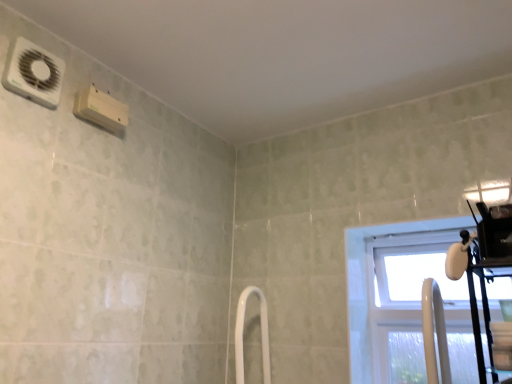
Question: From a real-world perspective, is white glossy shower door at center physically below transparent plastic window at right?

Choices:
 (A) yes
 (B) no

Answer: (A)

Question: Does white glossy shower door at center have a larger size compared to transparent plastic window at right?

Choices:
 (A) yes
 (B) no

Answer: (B)

Question: From the image's perspective, is white glossy shower door at center above transparent plastic window at right?

Choices:
 (A) no
 (B) yes

Answer: (A)

Question: Can you confirm if white glossy shower door at center is positioned to the left of transparent plastic window at right?

Choices:
 (A) no
 (B) yes

Answer: (B)

Question: Is white glossy shower door at center not close to transparent plastic window at right?

Choices:
 (A) yes
 (B) no

Answer: (B)

Question: Is white glossy shower door at center taller or shorter than transparent plastic window at right?

Choices:
 (A) tall
 (B) short

Answer: (B)

Question: In the image, is white glossy shower door at center on the left side or the right side of transparent plastic window at right?

Choices:
 (A) left
 (B) right

Answer: (A)

Question: From a real-world perspective, is white glossy shower door at center above or below transparent plastic window at right?

Choices:
 (A) above
 (B) below

Answer: (B)

Question: From the image's perspective, is white glossy shower door at center positioned above or below transparent plastic window at right?

Choices:
 (A) below
 (B) above

Answer: (A)

Question: Does point (41, 104) appear closer or farther from the camera than point (266, 357)?

Choices:
 (A) farther
 (B) closer

Answer: (B)

Question: Considering the positions of white plastic air conditioning unit at upper left and white glossy shower door at center in the image, is white plastic air conditioning unit at upper left taller or shorter than white glossy shower door at center?

Choices:
 (A) short
 (B) tall

Answer: (A)

Question: Would you say white plastic air conditioning unit at upper left is to the left or to the right of white glossy shower door at center in the picture?

Choices:
 (A) right
 (B) left

Answer: (B)

Question: Is white plastic air conditioning unit at upper left in front of or behind white glossy shower door at center in the image?

Choices:
 (A) front
 (B) behind

Answer: (A)

Question: Is white plastic air conditioning unit at upper left to the left or to the right of transparent plastic window at right in the image?

Choices:
 (A) left
 (B) right

Answer: (A)

Question: Considering the positions of point (41, 77) and point (393, 228), is point (41, 77) closer or farther from the camera than point (393, 228)?

Choices:
 (A) farther
 (B) closer

Answer: (B)